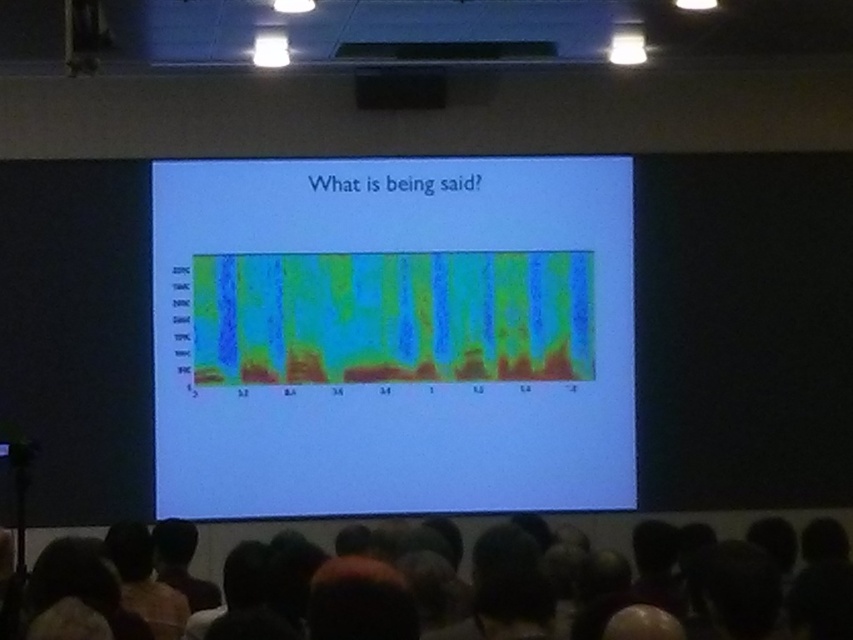
Question: In this image, where is green gradient heatmap at center located relative to dark hair at lower center?

Choices:
 (A) above
 (B) below

Answer: (A)

Question: Which of the following is the closest to the observer?

Choices:
 (A) dark hair at lower center
 (B) green gradient heatmap at center

Answer: (A)

Question: Can you confirm if green gradient heatmap at center is wider than black matte speaker at upper center?

Choices:
 (A) yes
 (B) no

Answer: (A)

Question: Which of the following is the farthest from the observer?

Choices:
 (A) (740, 520)
 (B) (184, 324)

Answer: (A)

Question: Can you confirm if green gradient heatmap at center is smaller than black matte speaker at upper center?

Choices:
 (A) no
 (B) yes

Answer: (A)

Question: Based on their relative distances, which object is farther from the green gradient heatmap at center?

Choices:
 (A) black matte speaker at upper center
 (B) dark hair at lower center

Answer: (B)